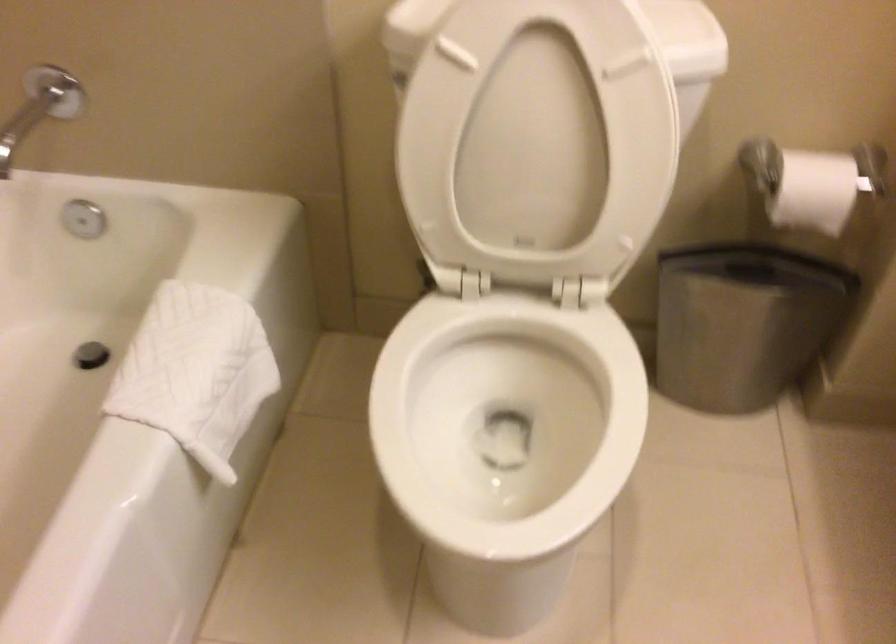
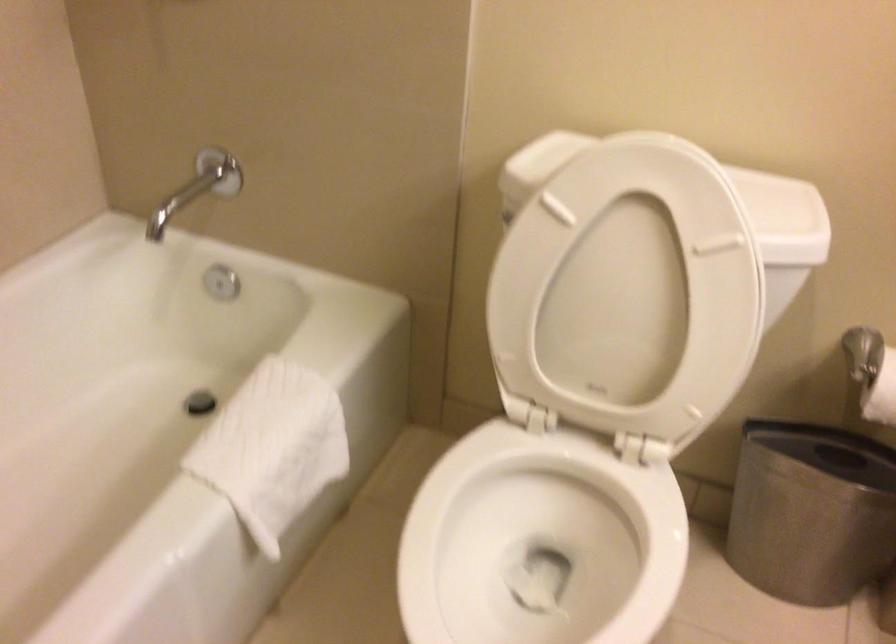
Locate, in the second image, the point that corresponds to point 546,120 in the first image.

(633, 285)